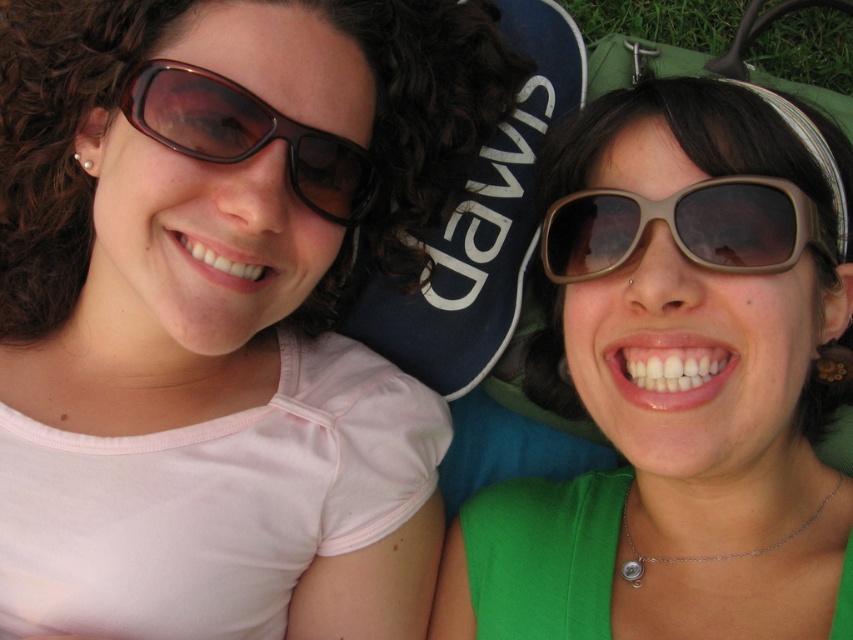
Does matte brown sunglasses at center appear on the right side of matte brown sunglasses at right?

Yes, matte brown sunglasses at center is to the right of matte brown sunglasses at right.

Looking at this image, between matte brown sunglasses at center and matte brown sunglasses at right, which one has more height?

Standing taller between the two is matte brown sunglasses at center.

Image resolution: width=853 pixels, height=640 pixels. Identify the location of matte brown sunglasses at center. click(x=677, y=385).

Does matte brown sunglasses at right have a lesser height compared to green grass at upper right?

Indeed, matte brown sunglasses at right has a lesser height compared to green grass at upper right.

Does matte brown sunglasses at right have a lesser width compared to green grass at upper right?

Correct, matte brown sunglasses at right's width is less than green grass at upper right's.

Who is more forward, (610, 272) or (827, 26)?

Point (610, 272) is more forward.

Find the location of a particular element. matte brown sunglasses at right is located at coordinates (683, 227).

Does point (682, 488) lie behind point (753, 60)?

That is False.

Is matte brown sunglasses at center wider than green grass at upper right?

Indeed, matte brown sunglasses at center has a greater width compared to green grass at upper right.

This screenshot has width=853, height=640. Identify the location of matte brown sunglasses at center. (677, 385).